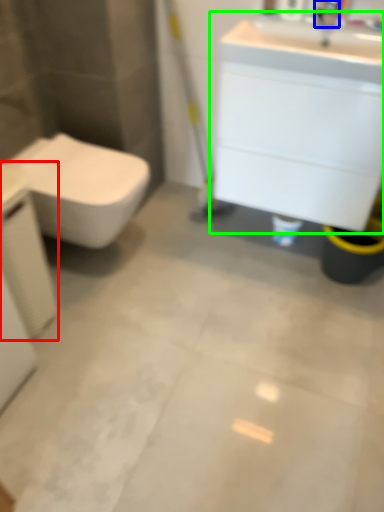
Question: Which object is the farthest from porcelain (highlighted by a red box)? Choose among these: faucet (highlighted by a blue box) or bathroom cabinet (highlighted by a green box).

Choices:
 (A) faucet
 (B) bathroom cabinet

Answer: (A)